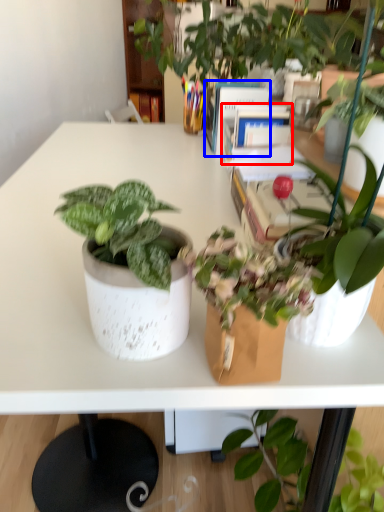
Question: Which object is closer to the camera taking this photo, book (highlighted by a red box) or book (highlighted by a blue box)?

Choices:
 (A) book
 (B) book

Answer: (A)